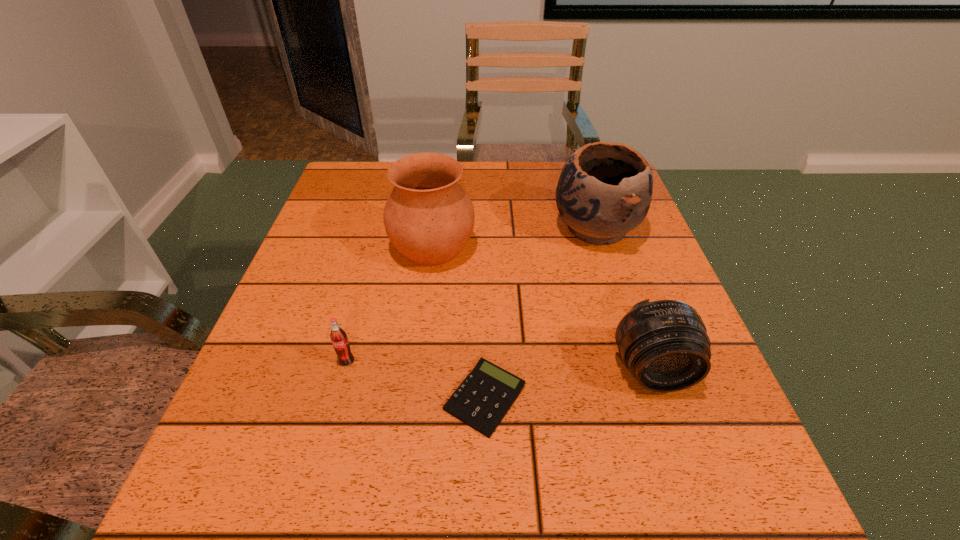
This screenshot has width=960, height=540. In order to click on the left pottery in this screenshot , I will do `click(428, 217)`.

In order to click on the right pottery in this screenshot , I will do `click(604, 191)`.

Locate an element on the screen. The image size is (960, 540). telephoto lens is located at coordinates (664, 344).

I want to click on soda bottle, so click(338, 336).

Find the location of `the second shortest object`. the second shortest object is located at coordinates (338, 336).

Image resolution: width=960 pixels, height=540 pixels. I want to click on the shortest object, so click(481, 401).

The height and width of the screenshot is (540, 960). Find the location of `free space located on the front of the left pottery`. free space located on the front of the left pottery is located at coordinates pyautogui.click(x=410, y=429).

Find the location of `vacant position located 0.120m on the back of the right pottery`. vacant position located 0.120m on the back of the right pottery is located at coordinates (579, 179).

Find the location of a particular element. free space located at the front element of the telephoto lens is located at coordinates (704, 523).

You are a GUI agent. You are given a task and a screenshot of the screen. Output one action in this format:
    pyautogui.click(x=<x>, y=<y>)
    Task: Click on the free space located on the label of the soda bottle
    The height and width of the screenshot is (540, 960).
    Given the screenshot: What is the action you would take?
    pyautogui.click(x=338, y=392)